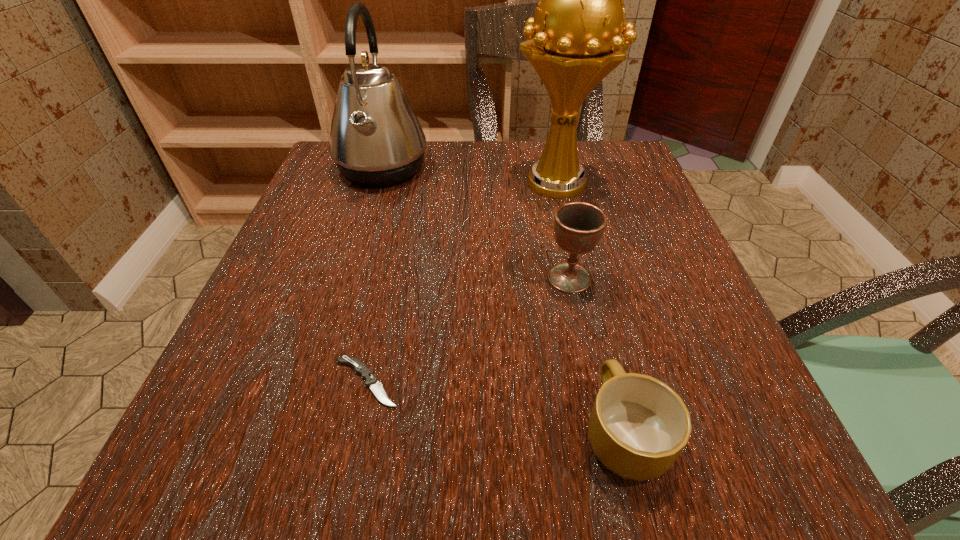
Locate an element on the screen. This screenshot has height=540, width=960. object situated at the far right corner is located at coordinates (573, 42).

Identify the location of object located at the near right corner. This screenshot has height=540, width=960. (638, 426).

In the image, there is a desktop. Identify the location of vacant space at the far edge. (520, 164).

The height and width of the screenshot is (540, 960). In order to click on vacant space at the near edge of the desktop in this screenshot , I will do `click(315, 496)`.

The image size is (960, 540). In order to click on vacant point at the left edge in this screenshot , I will do `click(219, 388)`.

Find the location of a particular element. The image size is (960, 540). vacant area at the right edge is located at coordinates (629, 213).

In the image, there is a desktop. Identify the location of vacant space at the far left corner. [324, 188].

The width and height of the screenshot is (960, 540). I want to click on free space at the near right corner of the desktop, so click(763, 430).

Locate an element on the screen. The height and width of the screenshot is (540, 960). free space between the mug and the tallest object is located at coordinates (590, 308).

The width and height of the screenshot is (960, 540). I want to click on empty location between the fourth tallest object and the pocketknife, so click(x=495, y=407).